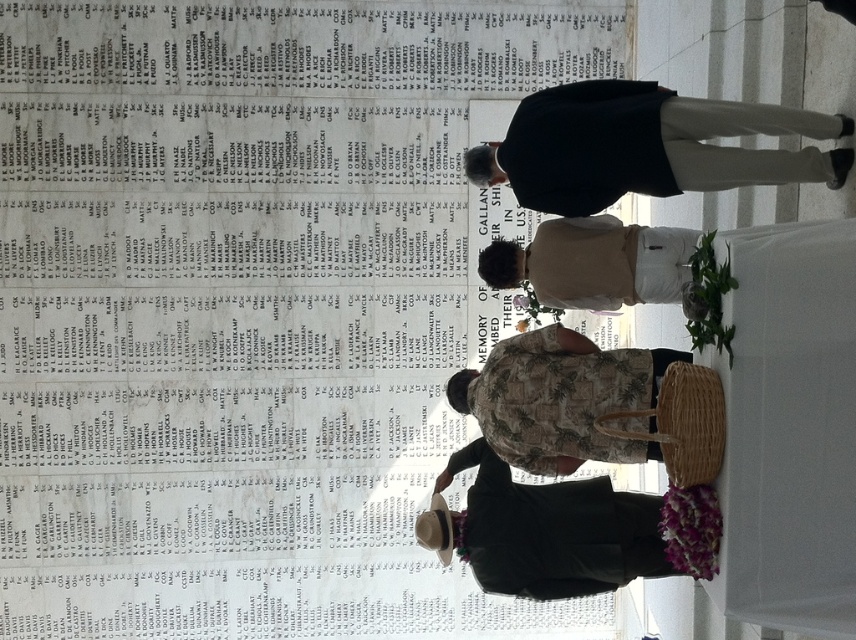
You are attending a memorial service and notice two people wearing a dark blue jacket at center and a camouflage fabric shirt at center. Which clothing item is bigger?

The dark blue jacket at center is larger in size than the camouflage fabric shirt at center.

You are attending a memorial service and notice the white marble wall at upper left and the dark blue jacket at center. Which object takes up more visual space in the image?

The dark blue jacket at center occupies more visual space than the white marble wall at upper left.

In the scene shown: You are a photographer positioned at the memorial site. You need to capture a photo that includes both the dark blue jacket at center and the camouflage fabric shirt at center. Which of the two will appear larger in the photo?

The dark blue jacket at center will appear larger in the photo because it is closer to the viewer than the camouflage fabric shirt at center.